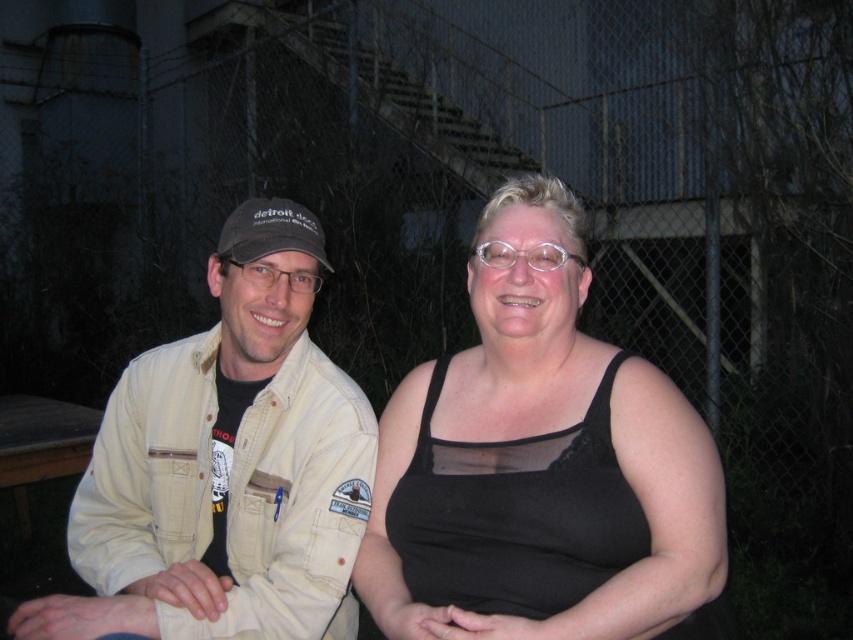
What are the coordinates of the beige cotton jacket at left?

The beige cotton jacket at left is located at coordinates point [225,467].

You are a photographer setting up a shoot in this scene. You need to position a small light source between the black sheer tank top at center and the dark gray fabric baseball cap at left. Based on their positions, where should you place the light source?

The black sheer tank top at center is below the dark gray fabric baseball cap at left, so you should place the light source between them by positioning it just above the black sheer tank top at center and below the dark gray fabric baseball cap at left.

What are the coordinates of the black sheer tank top at center?

The black sheer tank top at center is located at point (540, 465).